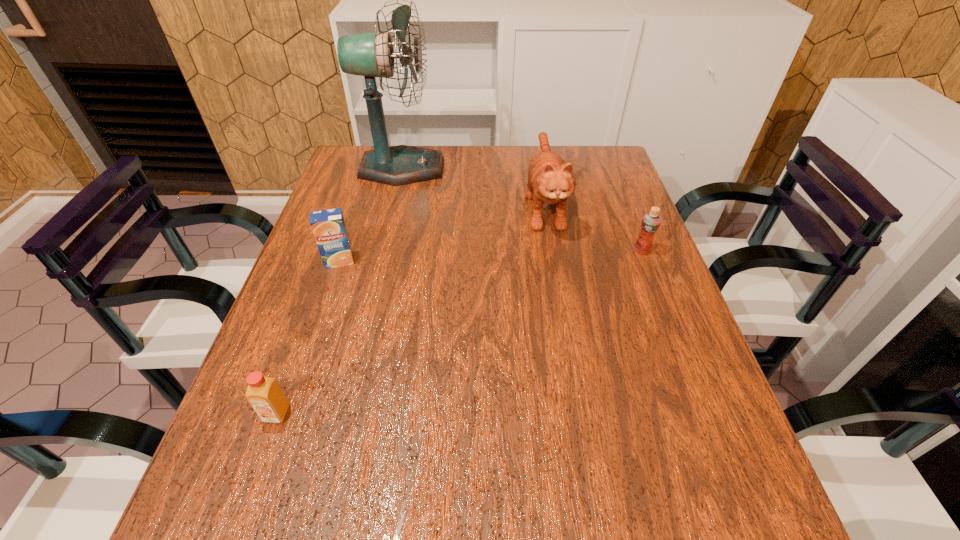
You are a GUI agent. You are given a task and a screenshot of the screen. Output one action in this format:
    pyautogui.click(x=<x>, y=<y>)
    Task: Click on the free space between the nearest orange juice and the fan
    This screenshot has width=960, height=540.
    Given the screenshot: What is the action you would take?
    pyautogui.click(x=340, y=291)

Where is `free point between the fourth shortest object and the fan`? The image size is (960, 540). free point between the fourth shortest object and the fan is located at coordinates (473, 186).

I want to click on empty space that is in between the fourth shortest object and the rightmost orange juice, so click(593, 227).

The height and width of the screenshot is (540, 960). Identify the location of free space between the second object from right to left and the tallest object. (473, 186).

Point out which object is positioned as the fourth nearest to the fourth shortest object. Please provide its 2D coordinates. Your answer should be formatted as a tuple, i.e. [(x, y)], where the tuple contains the x and y coordinates of a point satisfying the conditions above.

[(264, 394)]

The image size is (960, 540). Find the location of `the closest object relative to the fourth shortest object`. the closest object relative to the fourth shortest object is located at coordinates (651, 221).

Choose which orange juice is the nearest neighbor to the fan. Please provide its 2D coordinates. Your answer should be formatted as a tuple, i.e. [(x, y)], where the tuple contains the x and y coordinates of a point satisfying the conditions above.

[(328, 226)]

What are the coordinates of `the third closest orange juice to the fan` in the screenshot? It's located at (264, 394).

Where is `blank area in the image that satisfies the following two spatial constraints: 1. in front of the rightmost object where the wind blows; 2. on the right side of the tallest object`? This screenshot has width=960, height=540. blank area in the image that satisfies the following two spatial constraints: 1. in front of the rightmost object where the wind blows; 2. on the right side of the tallest object is located at coordinates (383, 251).

Identify the location of free space that satisfies the following two spatial constraints: 1. in front of the fan where the wind blows; 2. on the front and back of the nearest object. Image resolution: width=960 pixels, height=540 pixels. (345, 413).